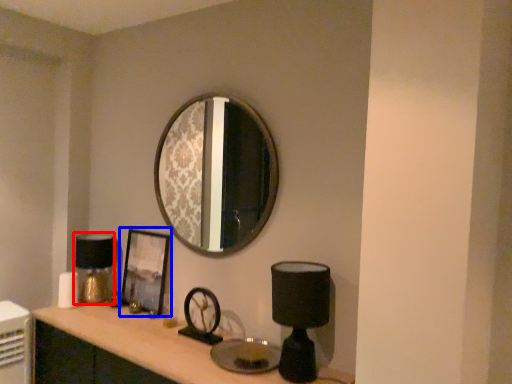
Question: Which point is further to the camera, table lamp (highlighted by a red box) or picture frame (highlighted by a blue box)?

Choices:
 (A) table lamp
 (B) picture frame

Answer: (A)